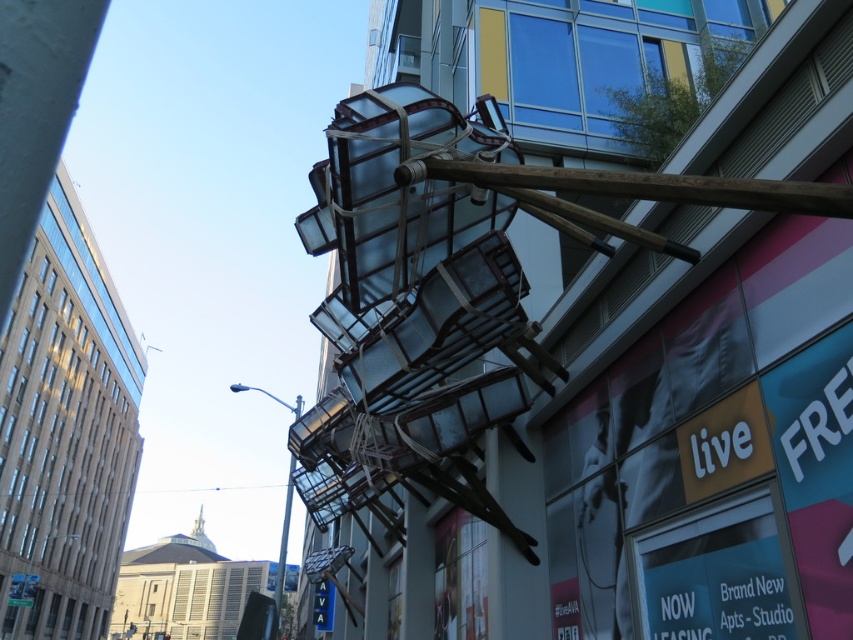
Is wooden pole at upper center smaller than transparent glass pole at upper center?

Correct, wooden pole at upper center occupies less space than transparent glass pole at upper center.

Can you confirm if wooden pole at upper center is positioned to the right of transparent glass pole at upper center?

Indeed, wooden pole at upper center is positioned on the right side of transparent glass pole at upper center.

Is point (578, 193) behind point (287, 480)?

No.

The image size is (853, 640). I want to click on wooden pole at upper center, so click(636, 184).